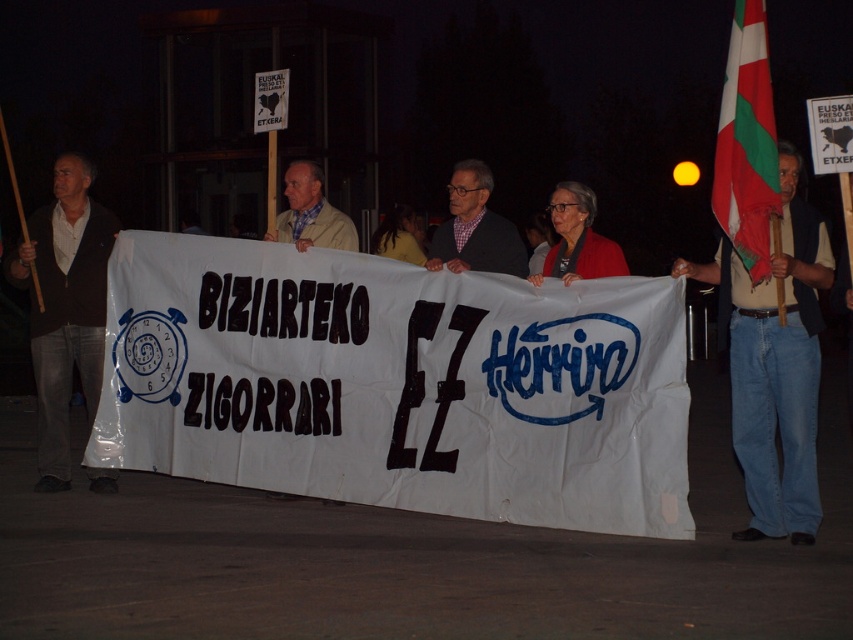
Question: Which is farther from the green-white striped flag at right?

Choices:
 (A) dark brown leather jacket at left
 (B) light beige jacket at center
 (C) checkered fabric shirt at center
 (D) denim jeans at center

Answer: (A)

Question: Which of the following is the farthest from the observer?

Choices:
 (A) (479, 188)
 (B) (36, 356)
 (C) (717, 147)
 (D) (779, 432)

Answer: (B)

Question: Does dark brown leather jacket at left have a greater width compared to light beige jacket at center?

Choices:
 (A) yes
 (B) no

Answer: (A)

Question: Which of these objects is positioned closest to the green-white striped flag at right?

Choices:
 (A) denim jeans at center
 (B) light beige jacket at center

Answer: (A)

Question: Can you confirm if green-white striped flag at right is wider than light beige jacket at center?

Choices:
 (A) yes
 (B) no

Answer: (B)

Question: Does checkered fabric shirt at center have a larger size compared to light beige jacket at center?

Choices:
 (A) no
 (B) yes

Answer: (B)